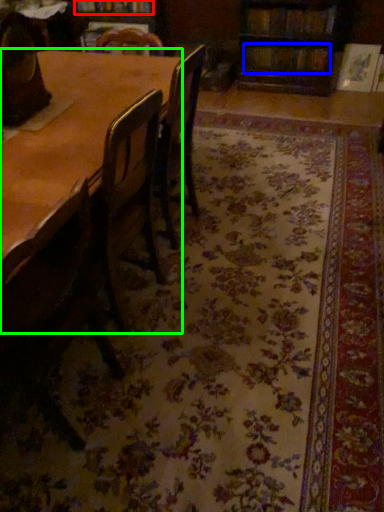
Question: Based on their relative distances, which object is nearer to book (highlighted by a red box)? Choose from book (highlighted by a blue box) and table (highlighted by a green box).

Choices:
 (A) book
 (B) table

Answer: (A)